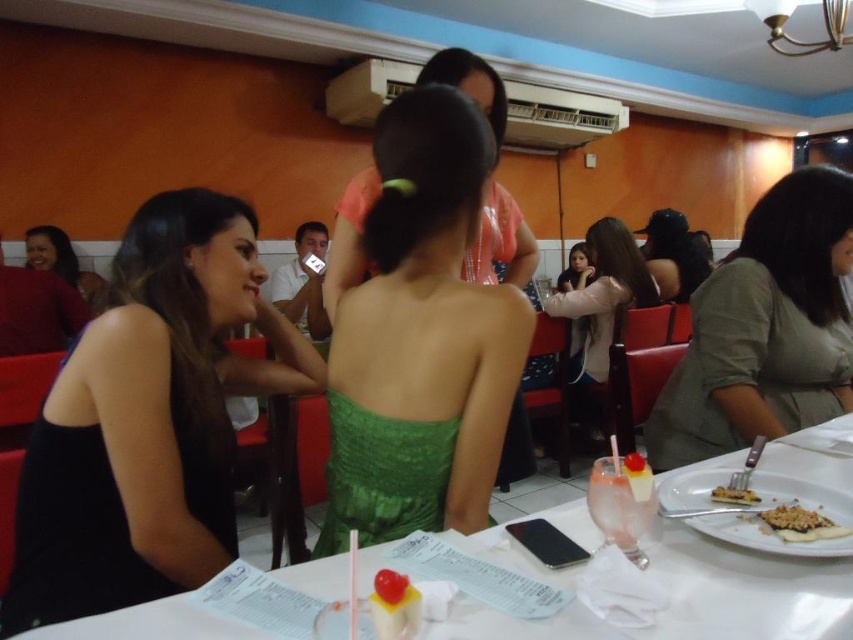
Question: Which point is farther to the camera?

Choices:
 (A) (772, 529)
 (B) (590, 362)
 (C) (42, 557)

Answer: (B)

Question: Is green textured dress at center to the right of pink glass drink at table center from the viewer's perspective?

Choices:
 (A) no
 (B) yes

Answer: (A)

Question: Is matte olive green blouse at right smaller than green textured dress at center?

Choices:
 (A) no
 (B) yes

Answer: (A)

Question: Does white paper table at center come behind crumbly brown cake at lower right?

Choices:
 (A) no
 (B) yes

Answer: (A)

Question: Which of the following is the closest to the observer?

Choices:
 (A) light pink fabric jacket at center
 (B) matte olive green blouse at right

Answer: (B)

Question: Which object appears closest to the camera in this image?

Choices:
 (A) light pink fabric jacket at center
 (B) green satin dress at center
 (C) matte olive green blouse at right

Answer: (B)